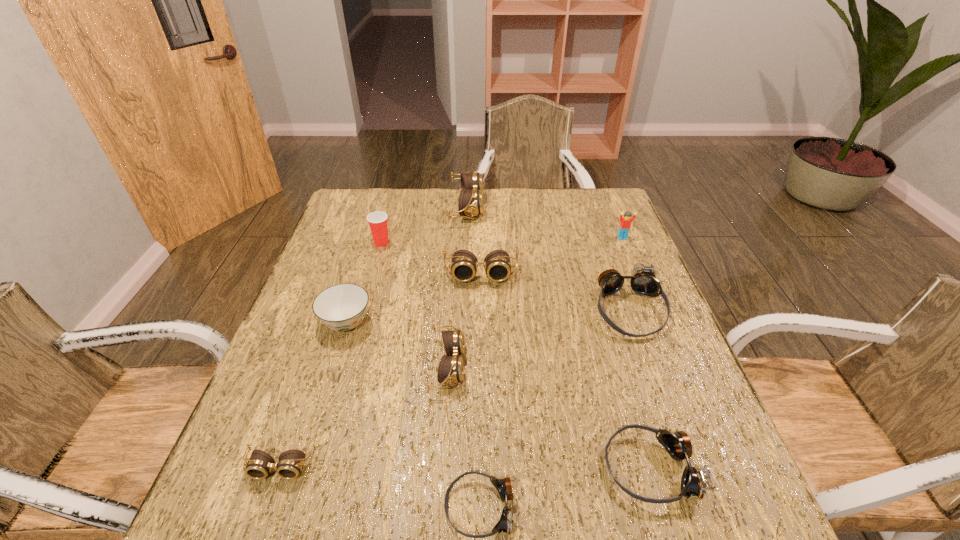
Locate an element on the screen. The width and height of the screenshot is (960, 540). the nearest brown goggles is located at coordinates (258, 467).

Image resolution: width=960 pixels, height=540 pixels. I want to click on vacant space located 0.140m through the lenses of the farthest brown goggles, so click(x=525, y=207).

Locate an element on the screen. This screenshot has height=540, width=960. vacant space located on the face of the red Lego is located at coordinates (664, 341).

Identify the location of free space located on the back of the red Dixie cup. (x=390, y=214).

Locate an element on the screen. This screenshot has width=960, height=540. free space located 0.160m through the lenses of the third smallest brown goggles is located at coordinates (481, 331).

This screenshot has height=540, width=960. I want to click on blank area located through the lenses of the farthest bronze goggles, so click(x=704, y=519).

Locate an element on the screen. blank space located on the right of the soup bowl is located at coordinates (479, 322).

In order to click on vacant region located 0.230m through the lenses of the second nearest brown goggles in this screenshot , I will do `click(567, 365)`.

Find the location of a particular element. The image size is (960, 540). vacant space located through the lenses of the second smallest bronze goggles is located at coordinates (451, 468).

Image resolution: width=960 pixels, height=540 pixels. I want to click on free space located through the lenses of the second smallest bronze goggles, so click(577, 468).